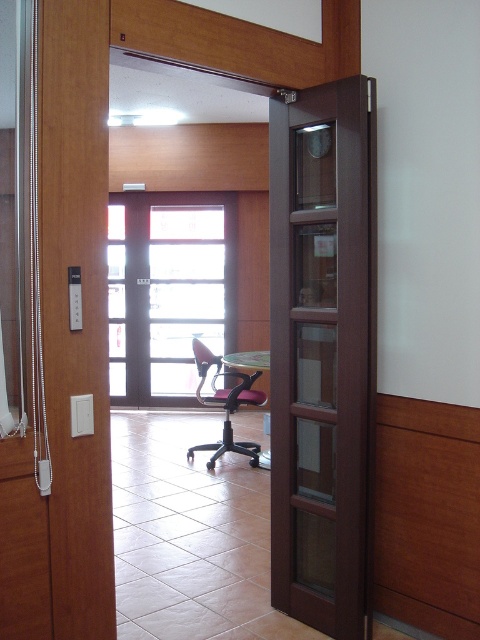
Who is positioned more to the right, clear glass door at center or pink fabric chair at center?

pink fabric chair at center is more to the right.

Who is lower down, clear glass door at center or pink fabric chair at center?

pink fabric chair at center is lower down.

Is point (120, 216) in front of point (256, 394)?

No, it is not.

Find the location of a particular element. The width and height of the screenshot is (480, 640). clear glass door at center is located at coordinates (168, 291).

Can you confirm if dark wood screen door at right is positioned below pink fabric chair at center?

Actually, dark wood screen door at right is above pink fabric chair at center.

From the picture: Does dark wood screen door at right appear on the left side of pink fabric chair at center?

Incorrect, dark wood screen door at right is not on the left side of pink fabric chair at center.

You are a GUI agent. You are given a task and a screenshot of the screen. Output one action in this format:
    pyautogui.click(x=<x>, y=<y>)
    Task: Click on the dark wood screen door at right
    This screenshot has width=480, height=640.
    Given the screenshot: What is the action you would take?
    pyautogui.click(x=323, y=353)

I want to click on dark wood screen door at right, so click(x=323, y=353).

Who is higher up, dark wood screen door at right or clear glass door at center?

clear glass door at center

Between dark wood screen door at right and clear glass door at center, which one is positioned lower?

dark wood screen door at right is below.

Who is more distant from viewer, (268, 131) or (121, 220)?

Point (121, 220)

Locate an element on the screen. The width and height of the screenshot is (480, 640). dark wood screen door at right is located at coordinates (323, 353).